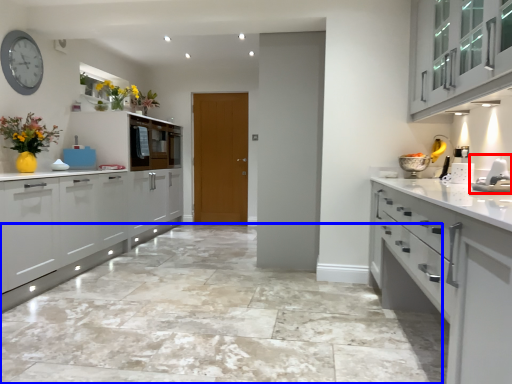
Question: Which of the following is the farthest to the observer, sink (highlighted by a red box) or granite (highlighted by a blue box)?

Choices:
 (A) sink
 (B) granite

Answer: (A)